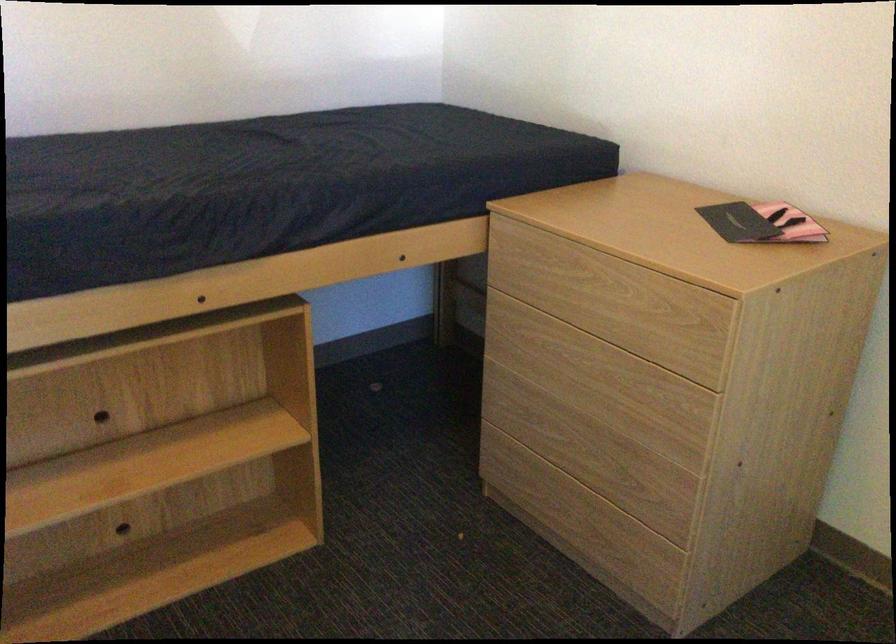
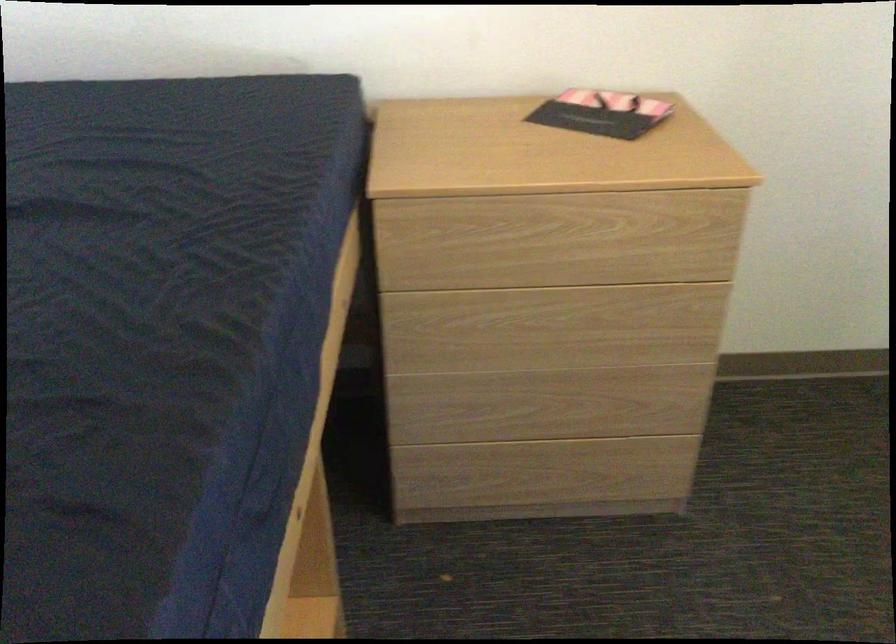
In the second image, find the point that corresponds to (x=549, y=395) in the first image.

(518, 368)